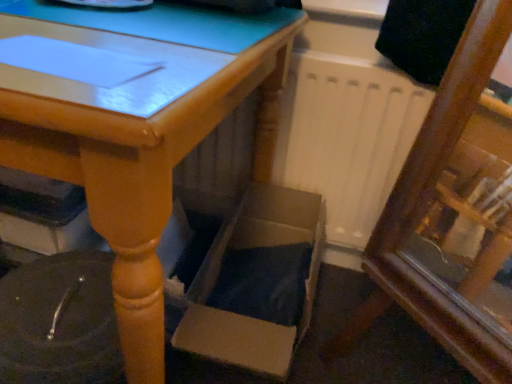
Question: Looking at their shapes, would you say wooden table at center is wider or thinner than cardboard box at lower center?

Choices:
 (A) wide
 (B) thin

Answer: (A)

Question: From a real-world perspective, is wooden table at center physically located above or below cardboard box at lower center?

Choices:
 (A) below
 (B) above

Answer: (B)

Question: From their relative heights in the image, would you say wooden table at center is taller or shorter than cardboard box at lower center?

Choices:
 (A) tall
 (B) short

Answer: (A)

Question: In the image, is cardboard box at lower center positioned in front of or behind wooden table at center?

Choices:
 (A) front
 (B) behind

Answer: (B)

Question: Considering the positions of cardboard box at lower center and wooden table at center in the image, is cardboard box at lower center wider or thinner than wooden table at center?

Choices:
 (A) thin
 (B) wide

Answer: (A)

Question: Considering the positions of point (304, 284) and point (52, 99), is point (304, 284) closer or farther from the camera than point (52, 99)?

Choices:
 (A) closer
 (B) farther

Answer: (B)

Question: Based on their sizes in the image, would you say cardboard box at lower center is bigger or smaller than wooden table at center?

Choices:
 (A) small
 (B) big

Answer: (A)